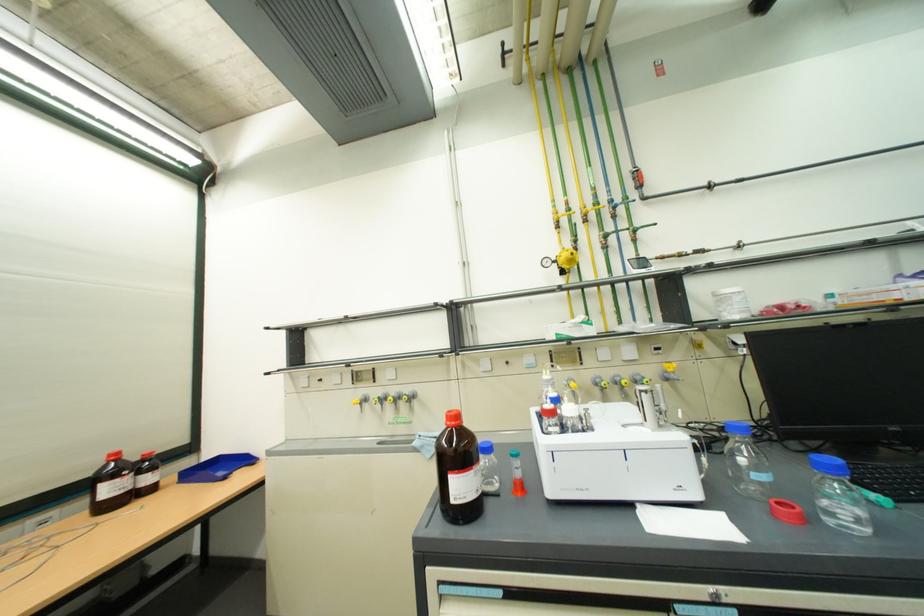
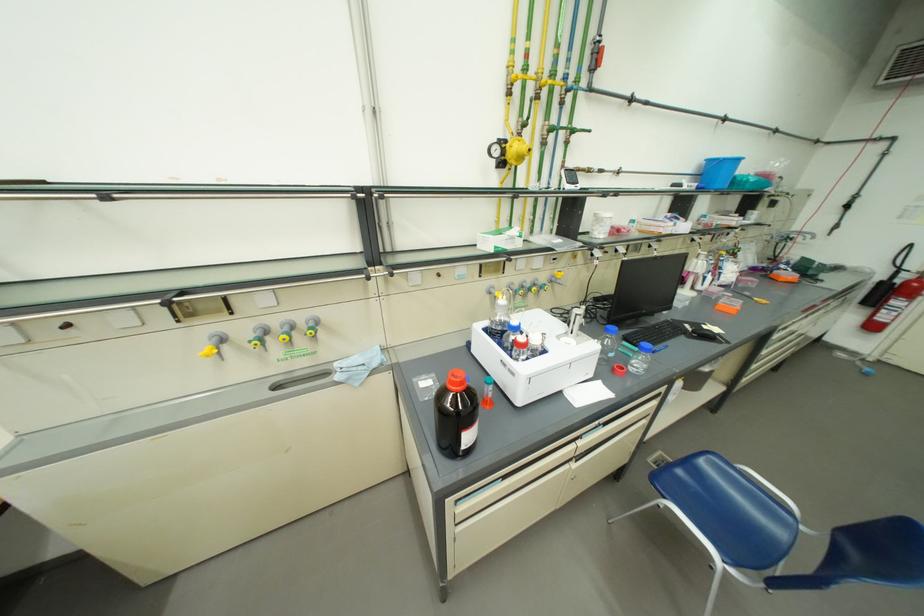
First-person continuous shooting, in which direction is the camera rotating?

The camera rotated toward right-down.